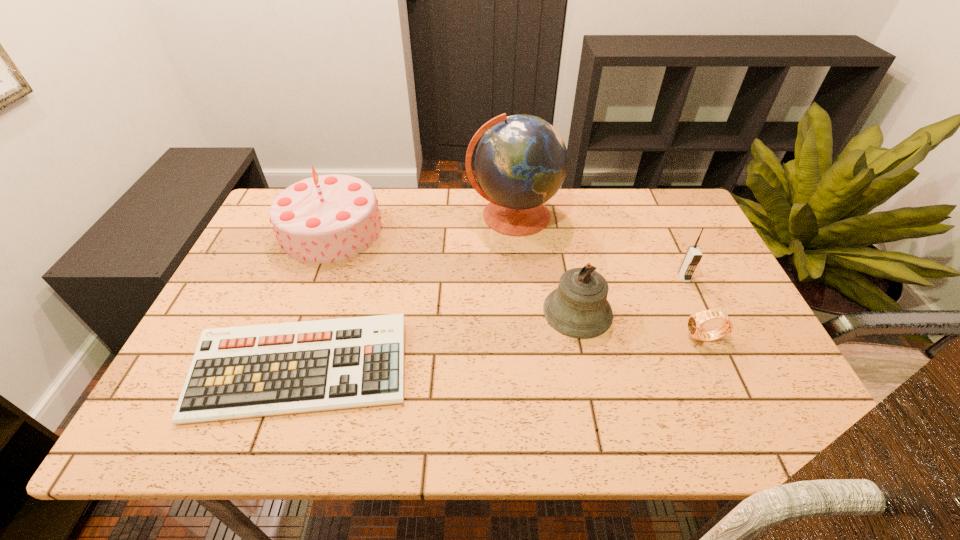
This screenshot has width=960, height=540. I want to click on free spot that satisfies the following two spatial constraints: 1. on the front side of the second tallest object; 2. on the right side of the bell, so click(x=300, y=312).